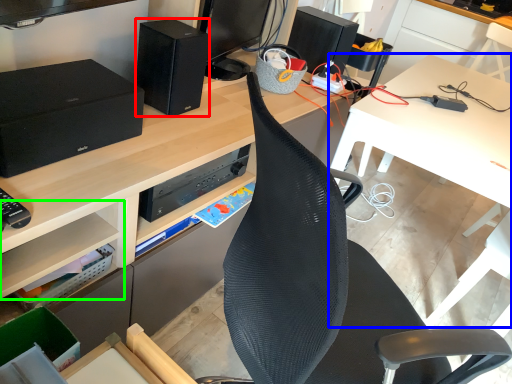
Question: Estimate the real-world distances between objects in this image. Which object is farther from speaker (highlighted by a red box), table (highlighted by a blue box) or shelf (highlighted by a green box)?

Choices:
 (A) table
 (B) shelf

Answer: (A)